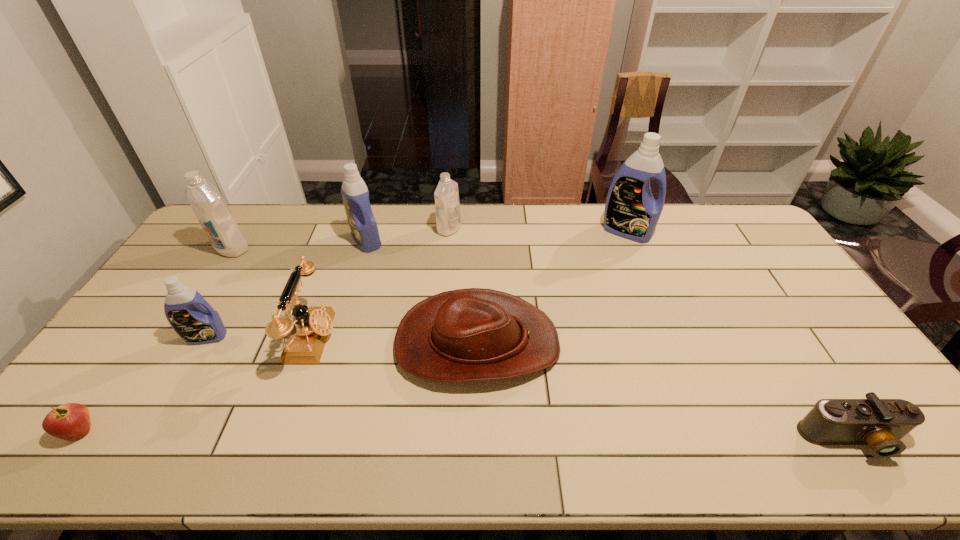
What are the coordinates of `the rightmost detergent` in the screenshot? It's located at (631, 212).

Locate an element on the screen. The image size is (960, 540). the eighth object from left to right is located at coordinates (631, 212).

Image resolution: width=960 pixels, height=540 pixels. Find the location of `the left white detergent`. the left white detergent is located at coordinates (215, 217).

In order to click on the second biggest blue detergent in this screenshot , I will do `click(355, 194)`.

Where is `the third detergent from right to left`? Image resolution: width=960 pixels, height=540 pixels. the third detergent from right to left is located at coordinates (355, 194).

Identify the location of the fourth detergent from left to right. (447, 205).

You are a GUI agent. You are given a task and a screenshot of the screen. Output one action in this format:
    pyautogui.click(x=<x>, y=<y>)
    Task: Click on the smaller white detergent
    
    Given the screenshot: What is the action you would take?
    click(447, 205)

Where is `the leftmost blue detergent`? Image resolution: width=960 pixels, height=540 pixels. the leftmost blue detergent is located at coordinates (189, 314).

What are the coordinates of `the nearest blue detergent` in the screenshot? It's located at (189, 314).

This screenshot has width=960, height=540. I want to click on telephone, so click(x=307, y=335).